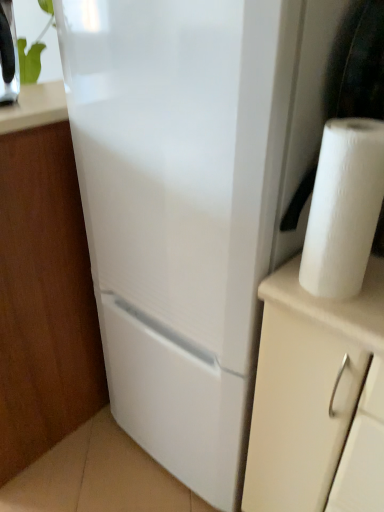
Question: Does white matte cabinet at lower left have a lesser height compared to white paper at right?

Choices:
 (A) yes
 (B) no

Answer: (B)

Question: Is white matte cabinet at lower left facing away from white paper at right?

Choices:
 (A) no
 (B) yes

Answer: (B)

Question: Would you say white matte cabinet at lower left is outside white paper at right?

Choices:
 (A) no
 (B) yes

Answer: (B)

Question: Is white matte cabinet at lower left to the right of white paper at right from the viewer's perspective?

Choices:
 (A) no
 (B) yes

Answer: (A)

Question: Is white paper at right completely or partially inside white matte cabinet at lower left?

Choices:
 (A) no
 (B) yes

Answer: (A)

Question: Does white matte cabinet at lower left appear on the left side of white paper at right?

Choices:
 (A) no
 (B) yes

Answer: (B)

Question: Could green leafy plant at upper left be considered to be inside white paper at right?

Choices:
 (A) no
 (B) yes

Answer: (A)

Question: Is white paper at right with green leafy plant at upper left?

Choices:
 (A) no
 (B) yes

Answer: (A)

Question: Is white paper at right not inside green leafy plant at upper left?

Choices:
 (A) yes
 (B) no

Answer: (A)

Question: Does white paper at right lie in front of green leafy plant at upper left?

Choices:
 (A) no
 (B) yes

Answer: (B)

Question: Is white paper at right behind green leafy plant at upper left?

Choices:
 (A) no
 (B) yes

Answer: (A)

Question: Does white paper at right appear on the right side of green leafy plant at upper left?

Choices:
 (A) no
 (B) yes

Answer: (B)

Question: Does green leafy plant at upper left come behind white matte cabinet at lower left?

Choices:
 (A) no
 (B) yes

Answer: (B)